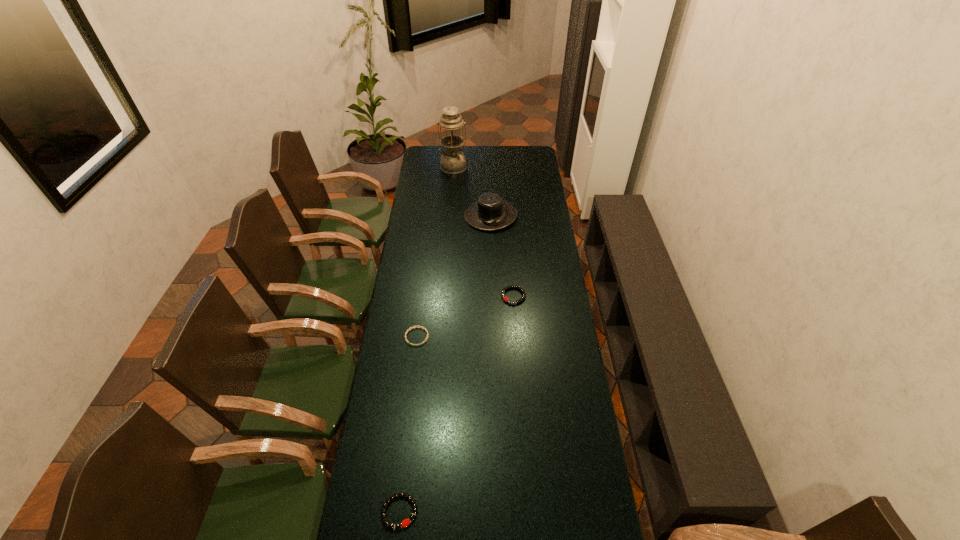
In order to click on the farthest object in this screenshot , I will do `click(453, 161)`.

In order to click on the tallest object in this screenshot , I will do `click(453, 161)`.

I want to click on dress hat, so click(490, 212).

Identify the location of the fourth shortest object. Image resolution: width=960 pixels, height=540 pixels. (490, 212).

Find the location of a particular element. the rightmost bracelet is located at coordinates (523, 297).

At what (x,y) coordinates should I click in order to perform the action: click on the third nearest object. Please return your answer as a coordinate pair (x, y). The height and width of the screenshot is (540, 960). Looking at the image, I should click on [x=523, y=297].

At what (x,y) coordinates should I click in order to perform the action: click on the nearest bracelet. Please return your answer as a coordinate pair (x, y). The height and width of the screenshot is (540, 960). Looking at the image, I should click on (404, 523).

You are a GUI agent. You are given a task and a screenshot of the screen. Output one action in this format:
    pyautogui.click(x=<x>, y=<y>)
    Task: Click on the shortest object
    The image size is (960, 540).
    Given the screenshot: What is the action you would take?
    pyautogui.click(x=413, y=326)

The width and height of the screenshot is (960, 540). In order to click on the fourth farthest object in this screenshot , I will do `click(413, 326)`.

The width and height of the screenshot is (960, 540). Find the location of `free space located on the right of the oil lamp`. free space located on the right of the oil lamp is located at coordinates (529, 167).